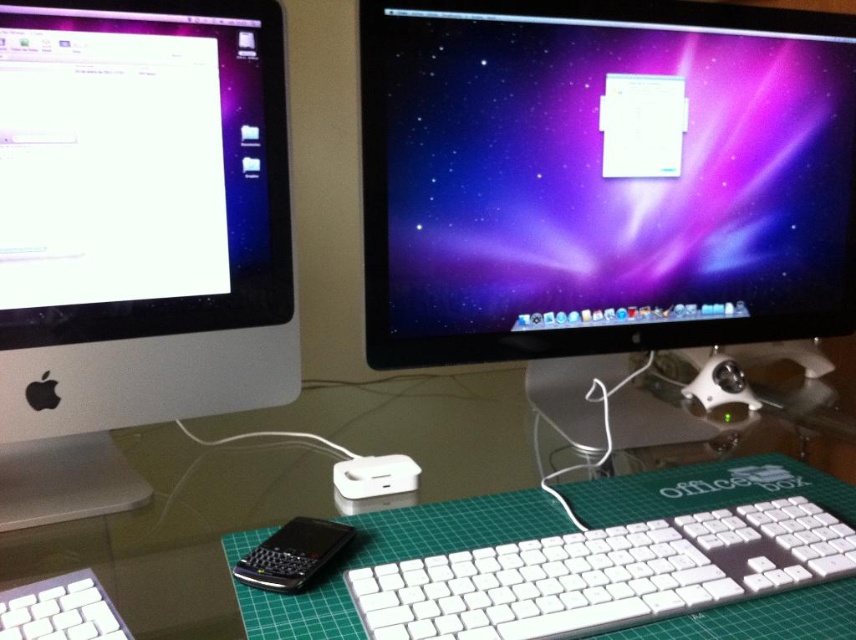
You are setting up a new keyboard on the transparent glass computer desk at center. The current white plastic keyboard at center is already placed 33.05 centimeters away from the desk. Can you place the new keyboard closer to the desk than the existing one?

The white plastic keyboard at center is currently 33.05 centimeters away from the transparent glass computer desk at center. To place the new keyboard closer, it needs to be positioned within less than 33.05 centimeters from the desk.

You are setting up a new computer and need to place the white plastic keyboard at center on the transparent glass computer desk at center. Is there enough space for the keyboard to be placed directly on the desk without overlapping the iMac computers?

The white plastic keyboard at center is already positioned in front of the transparent glass computer desk at center, so there is sufficient space for it to be placed directly on the desk without overlapping the iMac computers.

What are the coordinates of the white glossy computer monitor at left?

The white glossy computer monitor at left is located at coordinates (135, 236).